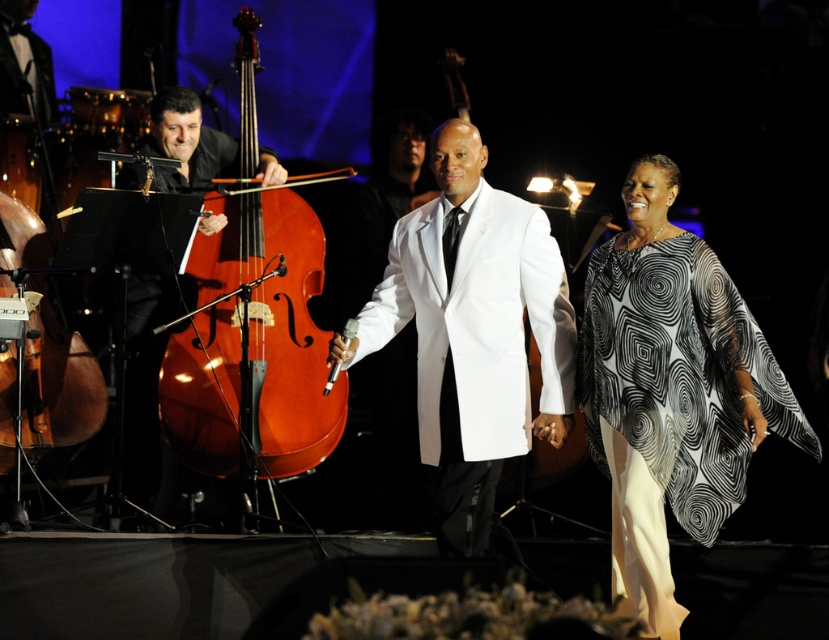
Who is positioned more to the left, white satin suit at center or shiny varnished cello at left?

shiny varnished cello at left

Is white satin suit at center wider than shiny varnished cello at left?

Yes, white satin suit at center is wider than shiny varnished cello at left.

This screenshot has width=829, height=640. Describe the element at coordinates (473, 332) in the screenshot. I see `white satin suit at center` at that location.

Where is `white satin suit at center`? Image resolution: width=829 pixels, height=640 pixels. white satin suit at center is located at coordinates (473, 332).

Which is behind, point (725, 499) or point (124, 484)?

Point (124, 484)

Describe the element at coordinates (671, 390) in the screenshot. I see `black and white printed fabric at center` at that location.

Between point (667, 440) and point (158, 120), which one is positioned behind?

Point (158, 120)

This screenshot has height=640, width=829. Find the location of `black and white printed fabric at center`. black and white printed fabric at center is located at coordinates (671, 390).

Is shiny brown cello at left closer to the viewer compared to brown polished wood violin at left?

No, shiny brown cello at left is further to the viewer.

Between point (178, 292) and point (64, 330), which one is positioned in front?

Point (64, 330) is more forward.

At what (x,y) coordinates should I click in order to perform the action: click on shiny brown cello at left. Please return your answer as a coordinate pair (x, y). The width and height of the screenshot is (829, 640). Looking at the image, I should click on (146, 374).